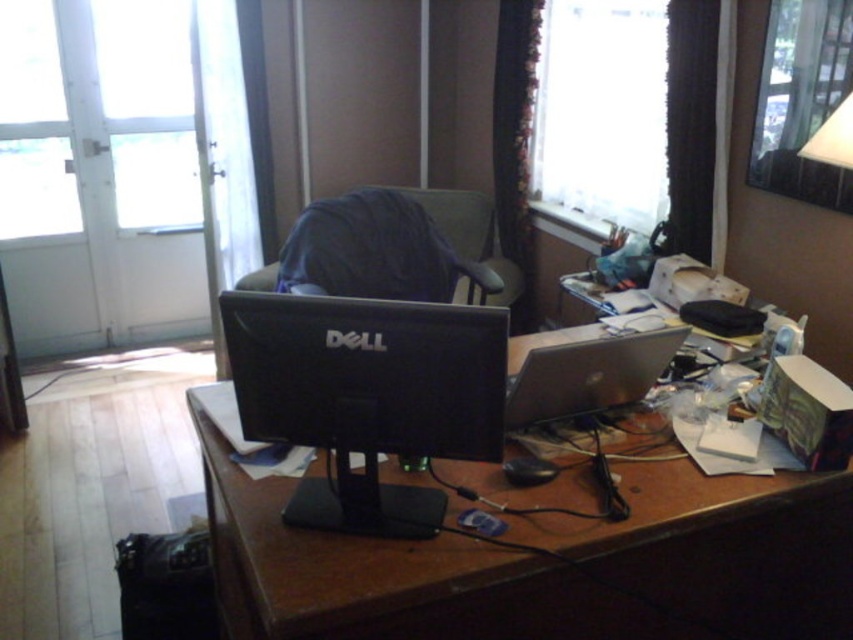
Question: Which object appears farthest from the camera in this image?

Choices:
 (A) silver metallic laptop at center
 (B) dark blue fabric swivel chair at center
 (C) black glossy monitor at center

Answer: (B)

Question: Is brown wooden desk at center smaller than silver metallic laptop at center?

Choices:
 (A) no
 (B) yes

Answer: (A)

Question: Among these points, which one is nearest to the camera?

Choices:
 (A) (437, 192)
 (B) (346, 445)

Answer: (B)

Question: Is black glossy monitor at center closer to camera compared to silver metallic laptop at center?

Choices:
 (A) no
 (B) yes

Answer: (B)

Question: Is dark blue fabric swivel chair at center thinner than silver metallic laptop at center?

Choices:
 (A) no
 (B) yes

Answer: (A)

Question: Which point is closer to the camera?

Choices:
 (A) silver metallic laptop at center
 (B) brown wooden desk at center

Answer: (B)